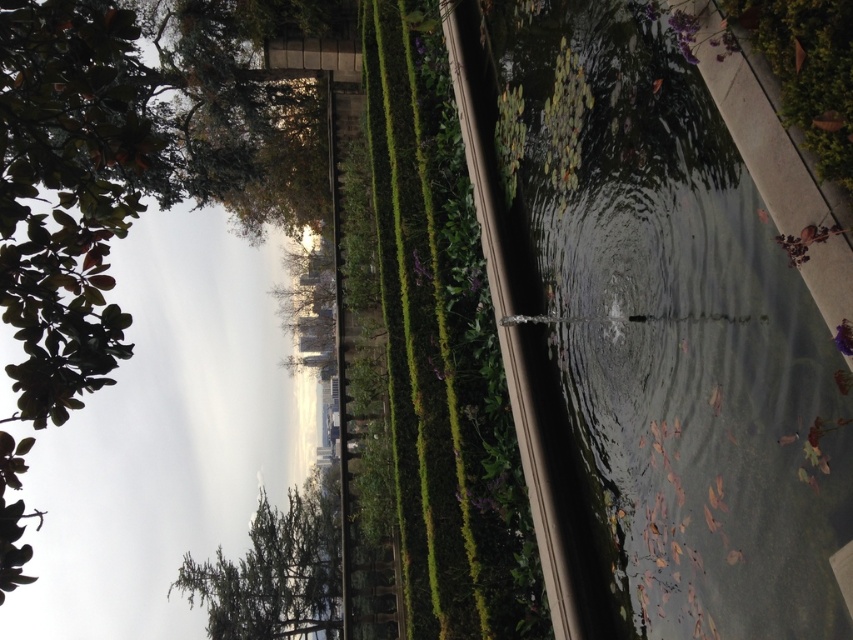
You are standing in the garden and want to take a photo of the clear glass pond at center and the green leafy tree at lower left. Which object should you focus on first if you want both to be in sharp focus?

You should focus on the clear glass pond at center first because it is closer to you than the green leafy tree at lower left, and adjusting focus from near to far will help ensure both are in sharp focus.